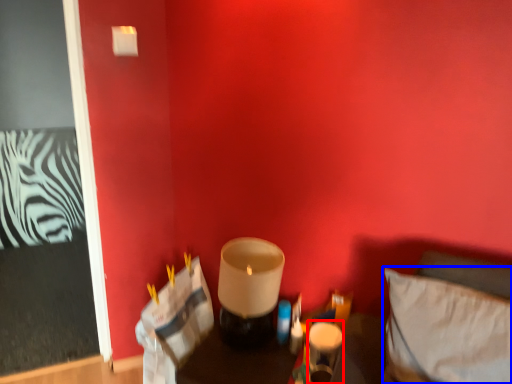
Question: Which object appears farthest to the camera in this image, candle holder (highlighted by a red box) or pillow (highlighted by a blue box)?

Choices:
 (A) candle holder
 (B) pillow

Answer: (A)